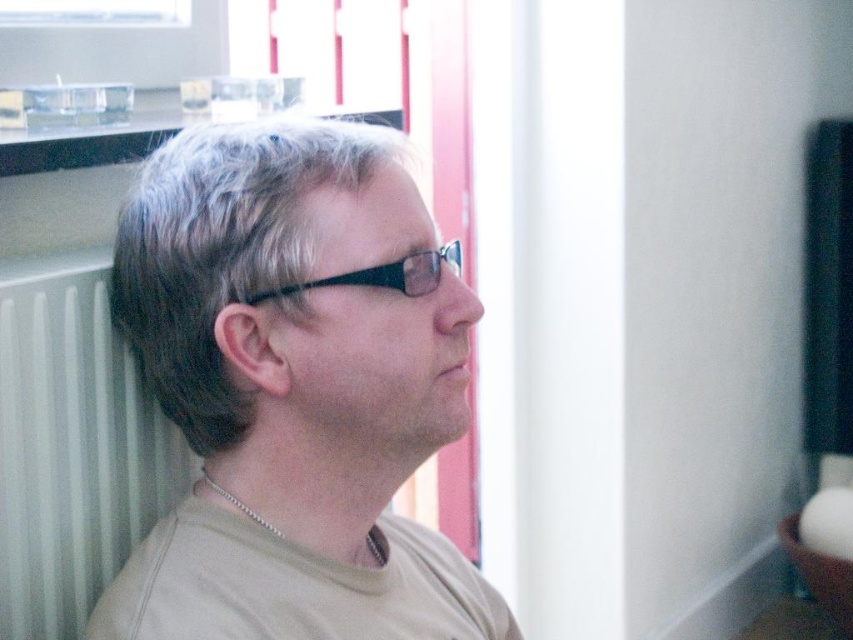
You are an interior designer assessing the lighting in this room. You notice the matte beige shirt at center and the gray matte hair at center. Which object is positioned lower in the frame?

The matte beige shirt at center is located below gray matte hair at center, so the matte beige shirt at center is positioned lower in the frame.

Consider the image. You are a photographer setting up for a portrait. You have to focus on the gray matte hair at center and the black plastic glasses at center. Which object should you adjust your focus to first if you want to ensure both are in sharp focus, considering their sizes?

The gray matte hair at center is larger in size than the black plastic glasses at center, so you should focus on the gray matte hair at center first to ensure both are in sharp focus.

You are a photographer setting up a shot of the person in the scene. You need to position a light source to the right of both the gray matte hair at center and the black plastic glasses at center. Is this possible given their positions?

The gray matte hair at center is to the left of black plastic glasses at center, so positioning a light source to the right of both is possible as the glasses are further to the right than the hair.